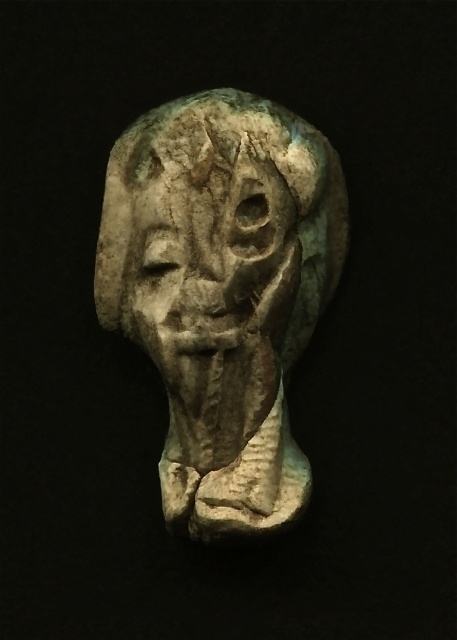
Which is more to the left, gray stone head at center or gray stone face at center?

Positioned to the left is gray stone face at center.

Image resolution: width=457 pixels, height=640 pixels. Describe the element at coordinates (223, 292) in the screenshot. I see `gray stone head at center` at that location.

Is point (240, 449) closer to viewer compared to point (243, 323)?

That is False.

Locate an element on the screen. The width and height of the screenshot is (457, 640). gray stone head at center is located at coordinates (223, 292).